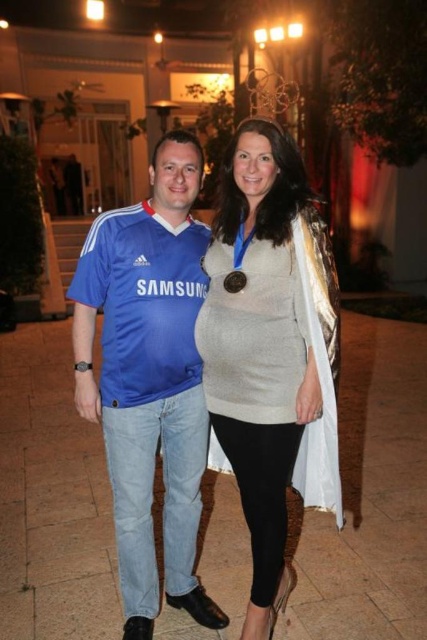
Question: Does blue jersey at center have a smaller size compared to matte gray sweater at center?

Choices:
 (A) yes
 (B) no

Answer: (B)

Question: Which of these objects is positioned closest to the matte gray sweater at center?

Choices:
 (A) blue jersey at center
 (B) gold metallic medal at center

Answer: (A)

Question: Which of the following is the closest to the observer?

Choices:
 (A) (152, 580)
 (B) (274, 147)
 (C) (239, 276)

Answer: (B)

Question: Which object is closer to the camera taking this photo?

Choices:
 (A) gold metallic medal at center
 (B) matte gray sweater at center
 (C) blue jersey at center

Answer: (B)

Question: Does blue jersey at center have a greater width compared to gold metallic medal at center?

Choices:
 (A) yes
 (B) no

Answer: (A)

Question: Is blue jersey at center positioned behind matte gray sweater at center?

Choices:
 (A) no
 (B) yes

Answer: (B)